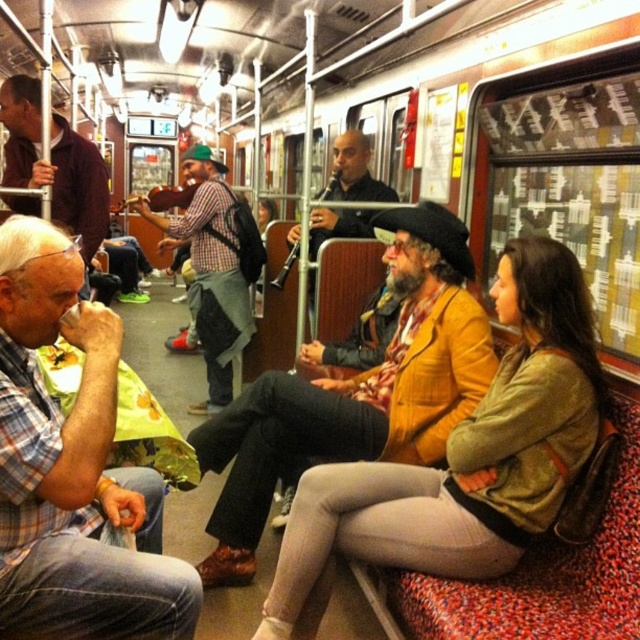
Between matte green jacket at center and checkered fabric shirt at center, which one appears on the left side from the viewer's perspective?

checkered fabric shirt at center is more to the left.

Which is below, matte green jacket at center or checkered fabric shirt at center?

matte green jacket at center is below.

Is point (563, 428) positioned before point (193, 211)?

Yes.

Locate an element on the screen. matte green jacket at center is located at coordinates (467, 452).

Which of these two, checkered fabric shirt at center or plaid shirt at left, stands taller?

checkered fabric shirt at center

Describe the element at coordinates (214, 268) in the screenshot. I see `checkered fabric shirt at center` at that location.

Locate an element on the screen. checkered fabric shirt at center is located at coordinates (214, 268).

From the picture: Does leather jacket at center come behind plaid shirt at left?

No, it is in front of plaid shirt at left.

Find the location of a particular element. This screenshot has height=640, width=640. leather jacket at center is located at coordinates (356, 392).

This screenshot has height=640, width=640. In order to click on leather jacket at center in this screenshot , I will do `click(356, 392)`.

The height and width of the screenshot is (640, 640). I want to click on leather jacket at center, so click(356, 392).